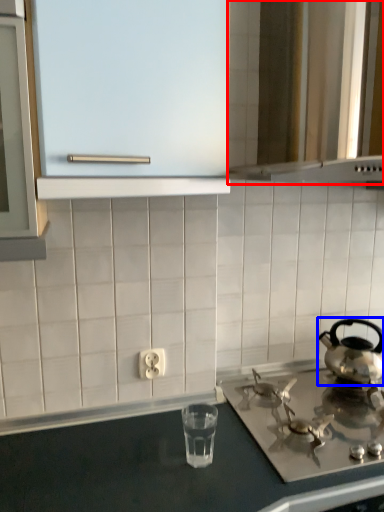
Question: Which object is closer to the camera taking this photo, vent (highlighted by a red box) or kettle (highlighted by a blue box)?

Choices:
 (A) vent
 (B) kettle

Answer: (A)